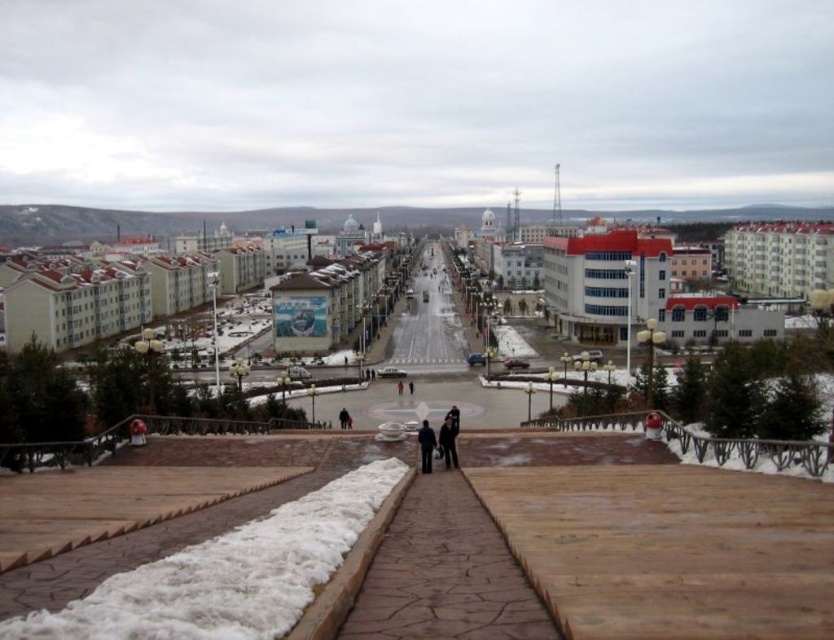
Question: Is the position of dark blue jeans at center more distant than that of dark blue jacket at center?

Choices:
 (A) no
 (B) yes

Answer: (B)

Question: Which point is farther to the camera?

Choices:
 (A) dark blue jacket at center
 (B) white fluffy snow at center
 (C) dark blue jeans at center

Answer: (C)

Question: Which object is the closest to the dark blue jacket at center?

Choices:
 (A) white fluffy snow at center
 (B) dark blue jeans at center

Answer: (B)

Question: Is white fluffy snow at center above dark blue jeans at center?

Choices:
 (A) yes
 (B) no

Answer: (B)

Question: Which point is farther from the camera taking this photo?

Choices:
 (A) (133, 577)
 (B) (451, 442)

Answer: (B)

Question: Is white fluffy snow at center positioned behind dark blue jacket at center?

Choices:
 (A) yes
 (B) no

Answer: (B)